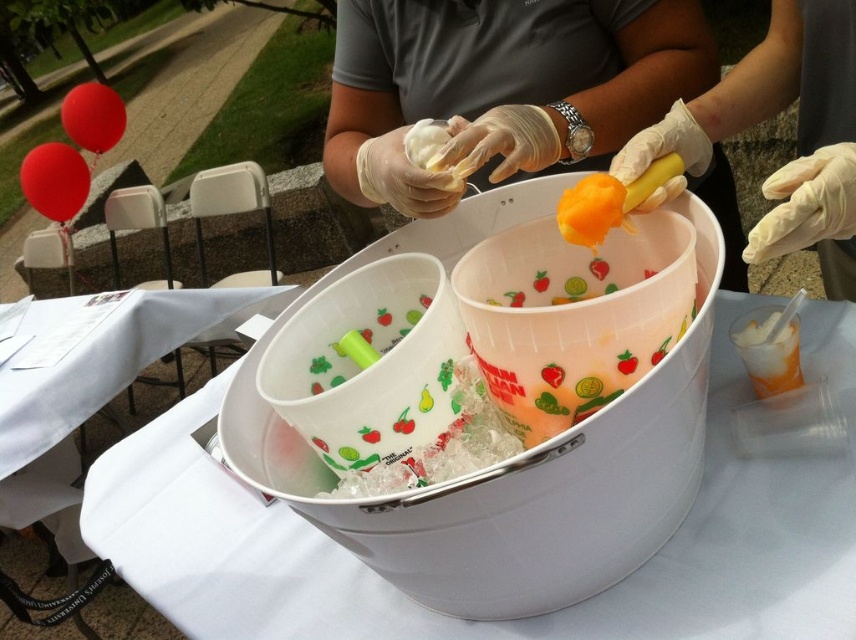
You are a photographer trying to capture the scene. You notice two points in the image at coordinates point [765,586] and point [819,227]. Which point is closer to the camera?

Point [819,227] is closer to the camera than point [765,586] because the description states that point [765,586] is further away.

How far apart are the two plastic containers in the white plastic bucket at center?

The two plastic containers in the white plastic bucket at center are 17.21 inches apart.